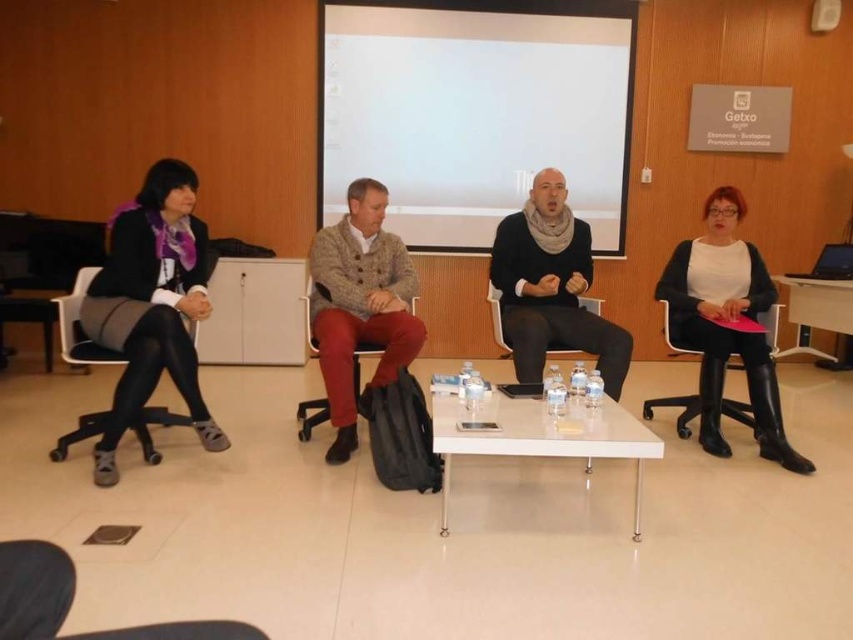
Question: Which object is the farthest from the black leather boots at right?

Choices:
 (A) white glossy table at center
 (B) white matte projection screen at upper center
 (C) knit sweater at center
 (D) white plastic chair at left

Answer: (D)

Question: Which point appears farthest from the camera in this image?

Choices:
 (A) (427, 198)
 (B) (561, 433)
 (C) (323, 403)
 (D) (753, 365)

Answer: (A)

Question: Is black leather chair at right to the right of leather at center from the viewer's perspective?

Choices:
 (A) no
 (B) yes

Answer: (B)

Question: Among these objects, which one is nearest to the camera?

Choices:
 (A) knit sweater at center
 (B) black leather chair at right
 (C) black leather chair at center
 (D) white plastic chair at left

Answer: (D)

Question: Can you confirm if black leather boots at right is wider than leather at center?

Choices:
 (A) no
 (B) yes

Answer: (B)

Question: Is white glossy table at center bigger than leather at center?

Choices:
 (A) no
 (B) yes

Answer: (A)